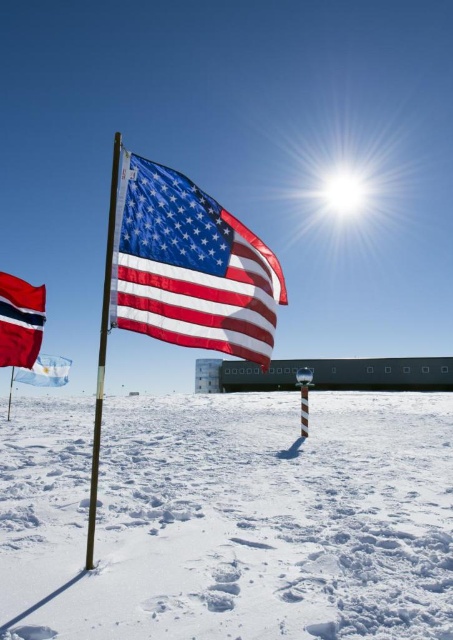
Between point (43, 285) and point (109, 285), which one is positioned in front?

Point (109, 285) is more forward.

Measure the distance between red fabric flag at lower left and camera.

6.16 meters

The image size is (453, 640). Identify the location of red fabric flag at lower left. (19, 321).

What are the coordinates of `red fabric flag at lower left` in the screenshot? It's located at (19, 321).

Does metallic silver flag pole at center have a lesser width compared to blue fabric flag at center?

Yes.

Image resolution: width=453 pixels, height=640 pixels. What do you see at coordinates (102, 349) in the screenshot? I see `metallic silver flag pole at center` at bounding box center [102, 349].

This screenshot has height=640, width=453. Find the location of `metallic silver flag pole at center`. metallic silver flag pole at center is located at coordinates (102, 349).

Locate an element on the screen. The height and width of the screenshot is (640, 453). metallic silver flag pole at center is located at coordinates (102, 349).

Is white fluffy snow at center positioned behind matte fabric flag at center?

No, it is not.

In order to click on white fluffy snow at center in this screenshot , I will do `click(231, 518)`.

Locate an element on the screen. This screenshot has height=640, width=453. white fluffy snow at center is located at coordinates [x=231, y=518].